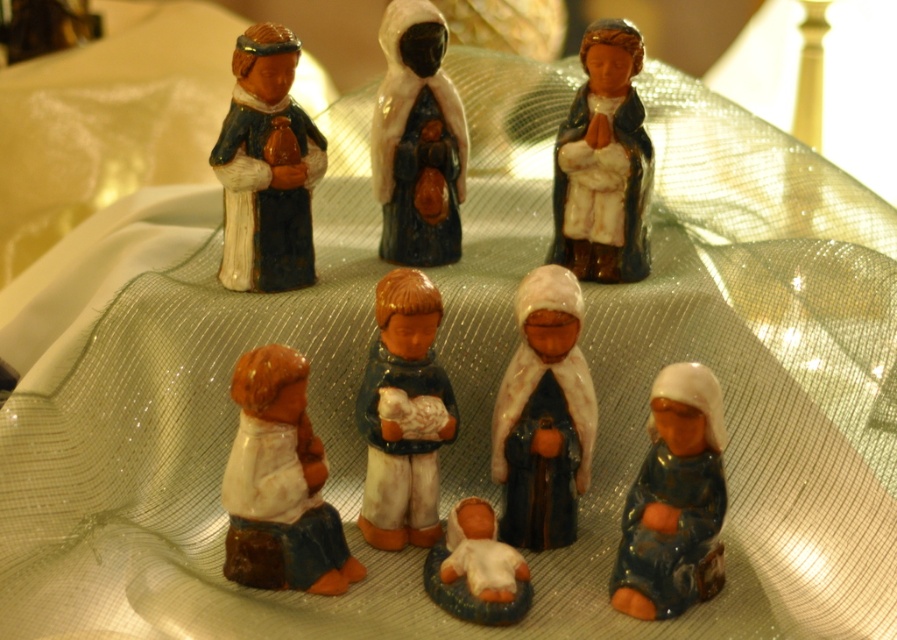
Is matte blue porcelain baby at lower right behind white glossy baby at center?

No, matte blue porcelain baby at lower right is in front of white glossy baby at center.

Who is higher up, matte blue porcelain baby at lower right or white glossy baby at center?

matte blue porcelain baby at lower right

Does point (639, 561) lie behind point (528, 593)?

No, (639, 561) is closer to viewer.

Identify the location of matte blue porcelain baby at lower right. The width and height of the screenshot is (897, 640). (675, 500).

Which is behind, point (669, 422) or point (386, 358)?

The point (386, 358) is behind.

Is matte blue porcelain baby at lower right to the left of matte brown figurine at center from the viewer's perspective?

Incorrect, matte blue porcelain baby at lower right is not on the left side of matte brown figurine at center.

Is point (645, 593) closer to camera compared to point (399, 349)?

Yes.

I want to click on matte blue porcelain baby at lower right, so click(675, 500).

Can you confirm if matte blue porcelain baby at lower right is thinner than matte blue robe at center?

Yes.

The width and height of the screenshot is (897, 640). Identify the location of matte blue porcelain baby at lower right. (675, 500).